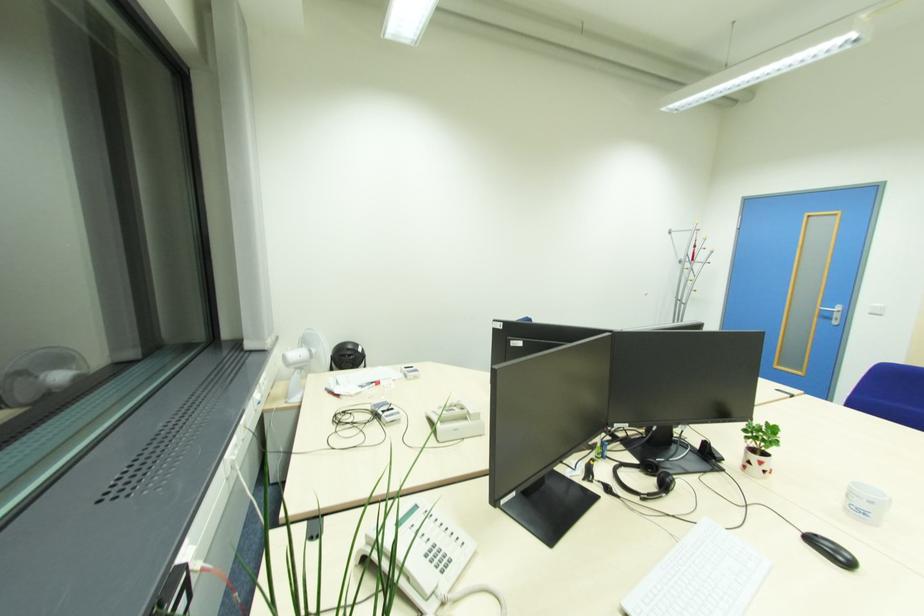
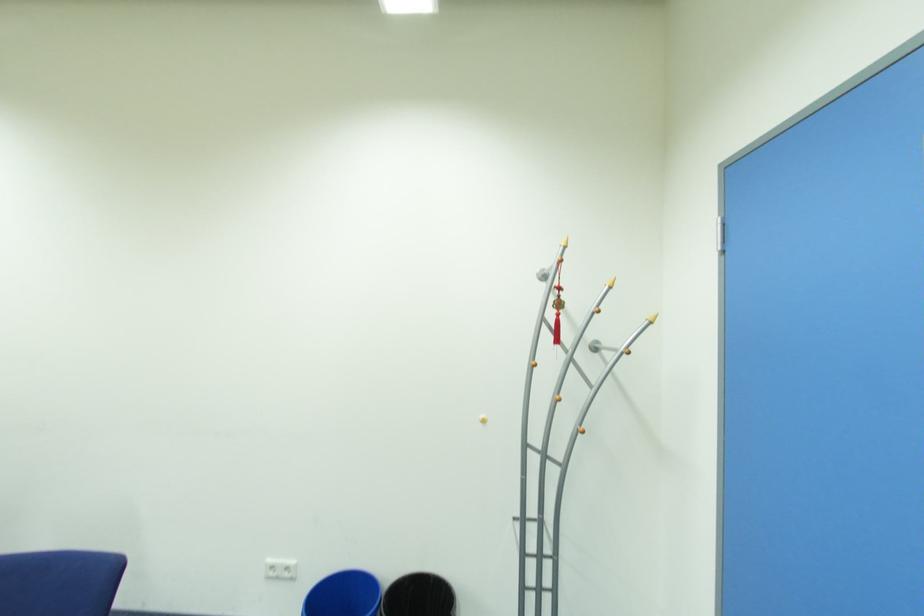
The images are taken continuously from a first-person perspective. In which direction are you moving?

The cameraman walked toward right, forward.